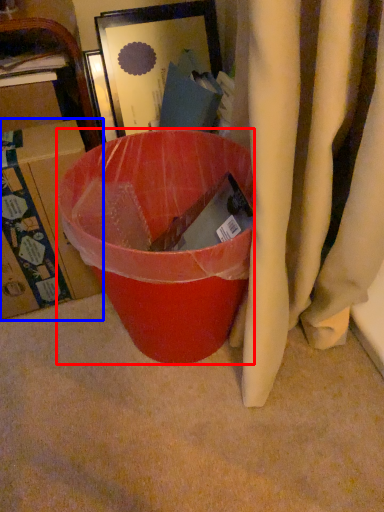
Question: Which point is closer to the camera, trash bin/can (highlighted by a red box) or box (highlighted by a blue box)?

Choices:
 (A) trash bin/can
 (B) box

Answer: (A)